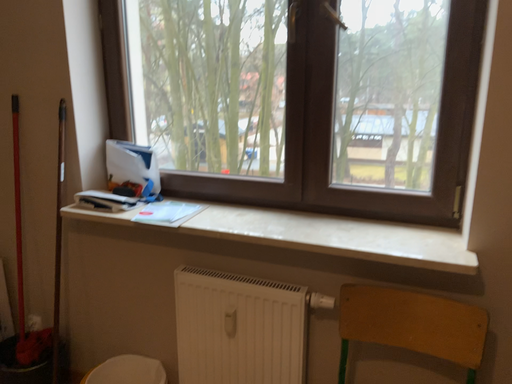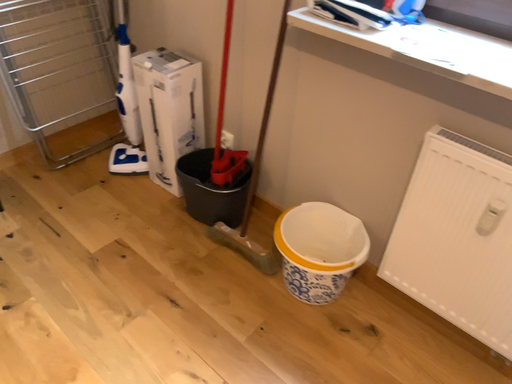
Question: How did the camera likely rotate when shooting the video?

Choices:
 (A) rotated right
 (B) rotated left

Answer: (B)